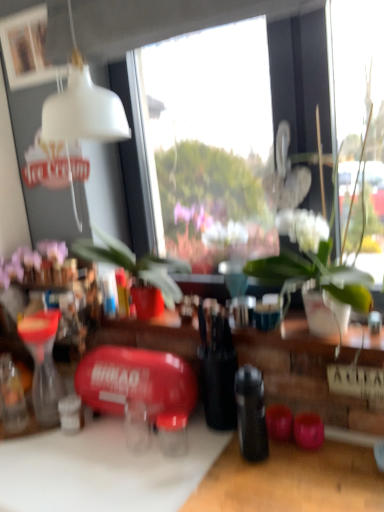
Question: From the image's perspective, relative to black matte bottle at center, is purple matte flowers at upper left above or below?

Choices:
 (A) below
 (B) above

Answer: (B)

Question: Is purple matte flowers at upper left to the left or to the right of black matte bottle at center in the image?

Choices:
 (A) left
 (B) right

Answer: (A)

Question: Which object is positioned closest to the white glossy vase at center?

Choices:
 (A) white matte picture frame at upper left
 (B) white matte cutting board at lower left
 (C) purple matte flowers at upper left
 (D) black matte bottle at center

Answer: (D)

Question: Which is farther from the white matte picture frame at upper left?

Choices:
 (A) purple matte flowers at upper left
 (B) black matte bottle at center
 (C) white matte cutting board at lower left
 (D) white glossy vase at center

Answer: (B)